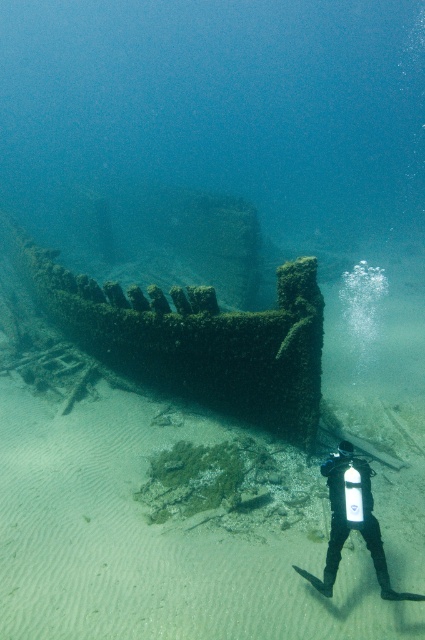
You are a diver with a 4 meter long safety rope. You are currently at the surface and want to reach the rusty metal shipwreck at center. Can you safely descend to the shipwreck using your rope?

The distance of the rusty metal shipwreck at center from the camera is 3.97 meters, so yes, the diver can safely descend to the shipwreck using their 4 meter long safety rope since it is slightly longer than the required distance.

From the picture: You are a marine archaeologist examining an underwater site. You notice a point marked at coordinates [192,337]. What object is located at that specific point?

The rusty metal shipwreck at center is located at point [192,337].

You are a marine biologist preparing to dive and inspect the underwater scene. You need to determine the vertical positioning of the rusty metal shipwreck at center and the black rubber wetsuit at lower center. Which object is taller in this environment?

The rusty metal shipwreck at center is not as tall as the black rubber wetsuit at lower center, so the black rubber wetsuit at lower center is taller.